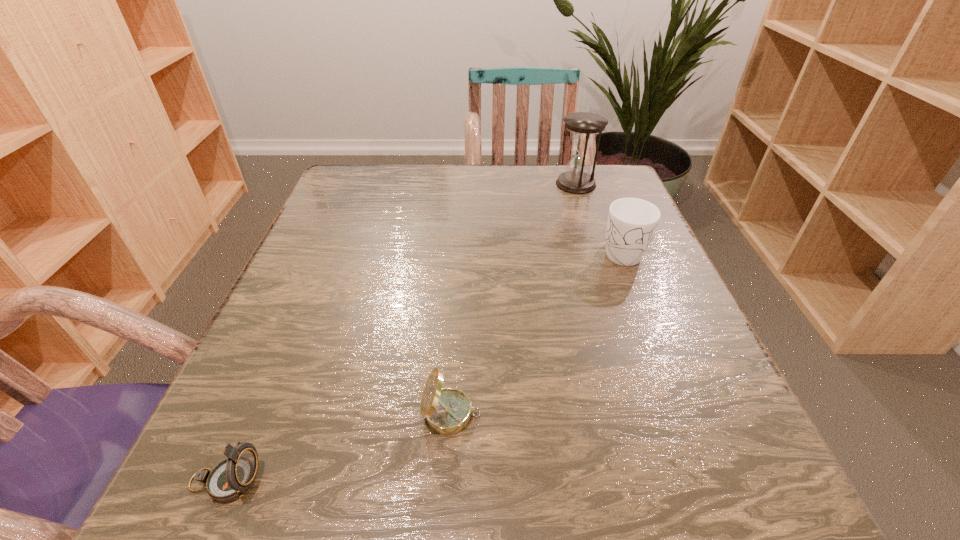
Identify the location of free area in between the mug and the right compass. (536, 333).

At what (x,y) coordinates should I click in order to perform the action: click on free space between the left compass and the tallest object. Please return your answer as a coordinate pair (x, y). Looking at the image, I should click on (400, 333).

In order to click on free spot between the farther compass and the left compass in this screenshot , I will do `click(338, 448)`.

Where is `empty location between the farther compass and the nearest object`? empty location between the farther compass and the nearest object is located at coordinates (338, 448).

Find the location of a particular element. The height and width of the screenshot is (540, 960). vacant area between the third shortest object and the hourglass is located at coordinates click(598, 218).

Locate an element on the screen. vacant area between the farther compass and the mug is located at coordinates (536, 333).

Locate an element on the screen. This screenshot has height=540, width=960. object that is the second closest to the nearest object is located at coordinates [632, 222].

I want to click on object identified as the second closest to the nearer compass, so click(632, 222).

This screenshot has width=960, height=540. I want to click on vacant space that satisfies the following two spatial constraints: 1. on the side of the mug with the handle; 2. with the dial facing the right compass, so click(685, 414).

At what (x,y) coordinates should I click in order to perform the action: click on vacant space that satisfies the following two spatial constraints: 1. on the side of the mug with the handle; 2. on the face of the leftmost object. Please return your answer as a coordinate pair (x, y). Looking at the image, I should click on (711, 481).